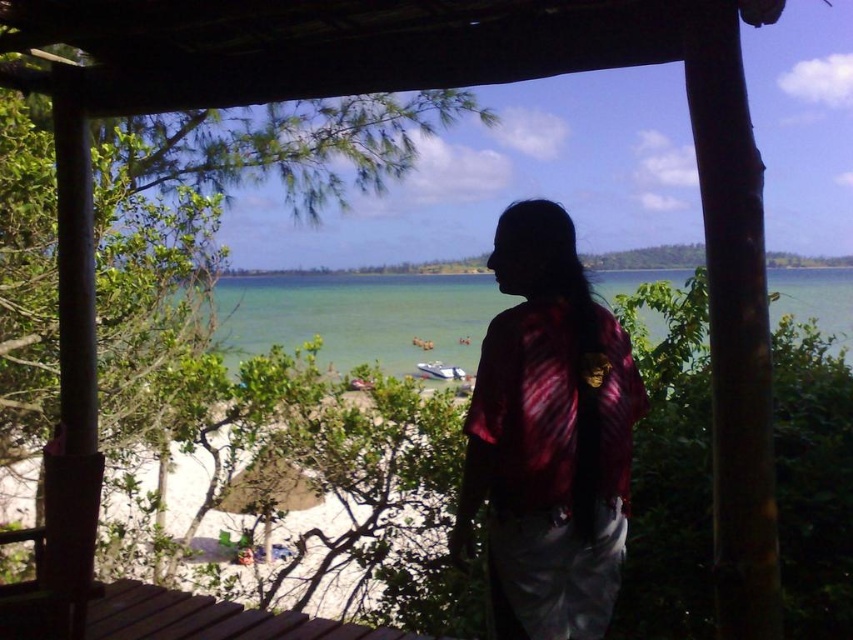
You are standing under the wooden structure in the beach scene. There is a point marked at coordinates (358, 316). What does this point represent?

The point at coordinates (358, 316) corresponds to clear water at center.

You are standing at the wooden structure and want to walk towards the two points marked on the beach. Which point, point [618,481] or point [223,611], should you head to first if you want to reach the closer one?

You should head to point [618,481] first because it is closer to the viewer than point [223,611].